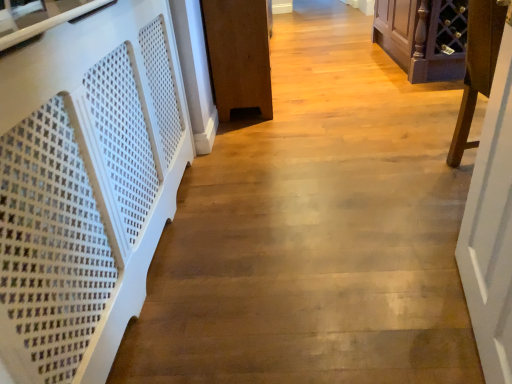
Find the location of a particular element. free space to the back side of white wooden door at right is located at coordinates (393, 247).